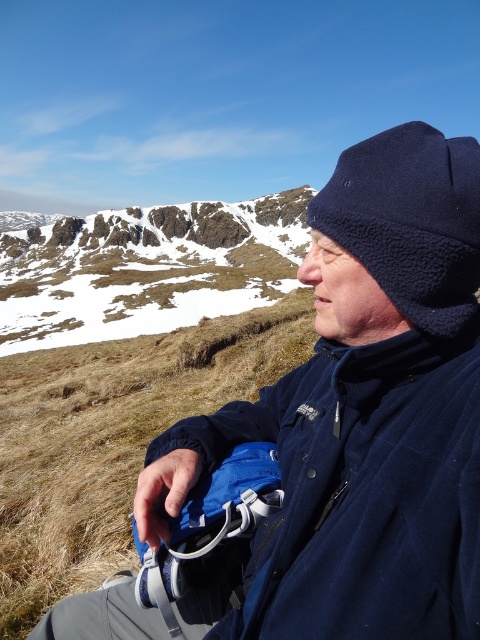
Who is higher up, navy blue fleece jacket at center or fleece hat at upper right?

fleece hat at upper right

Is point (405, 572) positioned in front of point (411, 269)?

Yes, it is.

Identify the location of navy blue fleece jacket at center. (361, 492).

The image size is (480, 640). I want to click on navy blue fleece jacket at center, so (361, 492).

Is navy blue fleece jacket at center wider than snowy rocky mountain at upper left?

In fact, navy blue fleece jacket at center might be narrower than snowy rocky mountain at upper left.

Who is lower down, navy blue fleece jacket at center or snowy rocky mountain at upper left?

navy blue fleece jacket at center

Between point (363, 604) and point (80, 333), which one is positioned in front?

Point (363, 604) is more forward.

I want to click on navy blue fleece jacket at center, so click(x=361, y=492).

From the picture: Is snowy rocky mountain at upper left wider than fleece hat at upper right?

Correct, the width of snowy rocky mountain at upper left exceeds that of fleece hat at upper right.

Who is more distant from viewer, (169,264) or (453,161)?

Positioned behind is point (169,264).

Image resolution: width=480 pixels, height=640 pixels. In order to click on snowy rocky mountain at upper left in this screenshot , I will do `click(149, 269)`.